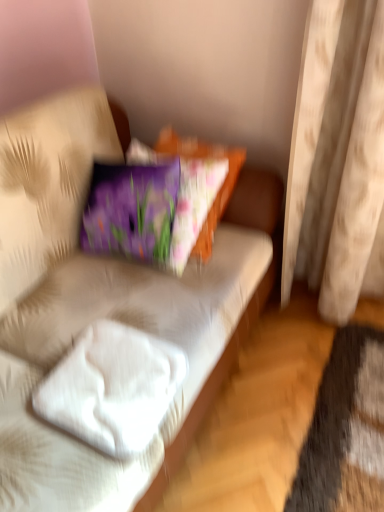
Question: Can you confirm if white fabric couch at center is positioned to the left of white soft pillow at lower left?

Choices:
 (A) no
 (B) yes

Answer: (A)

Question: Is white fabric couch at center facing towards white soft pillow at lower left?

Choices:
 (A) no
 (B) yes

Answer: (A)

Question: Is white fabric couch at center far from white soft pillow at lower left?

Choices:
 (A) yes
 (B) no

Answer: (B)

Question: Considering the relative sizes of white fabric couch at center and white soft pillow at lower left in the image provided, is white fabric couch at center bigger than white soft pillow at lower left?

Choices:
 (A) yes
 (B) no

Answer: (A)

Question: Would you say white fabric couch at center contains white soft pillow at lower left?

Choices:
 (A) yes
 (B) no

Answer: (B)

Question: From the image's perspective, is beige fabric curtain at right above or below white soft pillow at lower left?

Choices:
 (A) above
 (B) below

Answer: (A)

Question: Is point click(x=306, y=112) closer or farther from the camera than point click(x=79, y=416)?

Choices:
 (A) farther
 (B) closer

Answer: (A)

Question: Is beige fabric curtain at right in front of or behind white soft pillow at lower left in the image?

Choices:
 (A) front
 (B) behind

Answer: (B)

Question: In terms of width, does beige fabric curtain at right look wider or thinner when compared to white soft pillow at lower left?

Choices:
 (A) wide
 (B) thin

Answer: (B)

Question: Does point (240, 228) appear closer or farther from the camera than point (117, 445)?

Choices:
 (A) farther
 (B) closer

Answer: (A)

Question: Is white fabric couch at center wider or thinner than white soft pillow at lower left?

Choices:
 (A) thin
 (B) wide

Answer: (B)

Question: Looking at the image, does white fabric couch at center seem bigger or smaller compared to white soft pillow at lower left?

Choices:
 (A) big
 (B) small

Answer: (A)

Question: Is white fabric couch at center to the left or to the right of white soft pillow at lower left in the image?

Choices:
 (A) right
 (B) left

Answer: (A)

Question: Visually, is white soft pillow at lower left positioned to the left or to the right of white fabric couch at center?

Choices:
 (A) left
 (B) right

Answer: (A)

Question: Is point (71, 414) closer or farther from the camera than point (36, 377)?

Choices:
 (A) closer
 (B) farther

Answer: (A)